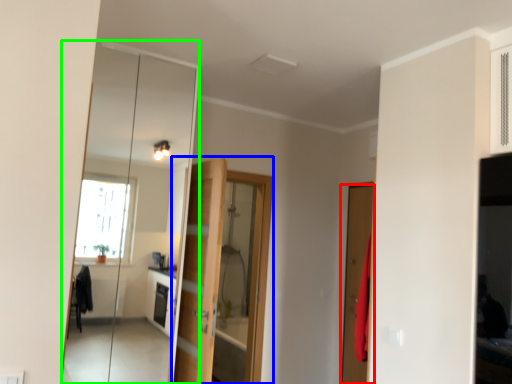
Question: Estimate the real-world distances between objects in this image. Which object is farther from door (highlighted by a red box), door (highlighted by a blue box) or mirror (highlighted by a green box)?

Choices:
 (A) door
 (B) mirror

Answer: (B)